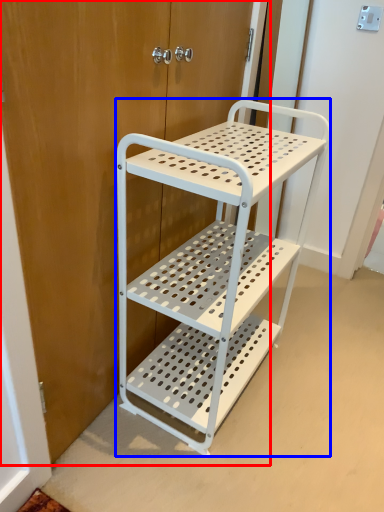
Question: Which object is closer to the camera taking this photo, door (highlighted by a red box) or furniture (highlighted by a blue box)?

Choices:
 (A) door
 (B) furniture

Answer: (A)